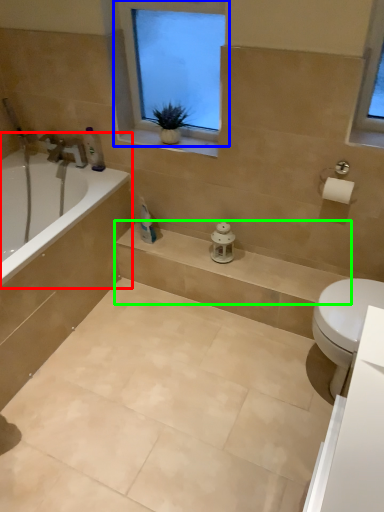
Question: Which object is the closest to the bathtub (highlighted by a red box)? Choose among these: window (highlighted by a blue box) or balustrade (highlighted by a green box).

Choices:
 (A) window
 (B) balustrade

Answer: (B)